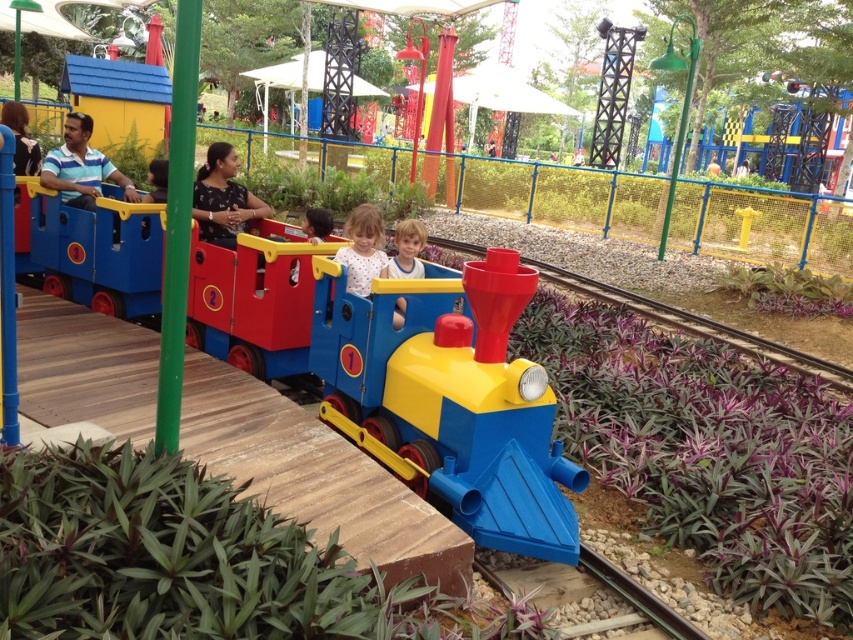
Question: Which point is closer to the camera taking this photo?

Choices:
 (A) (422, 243)
 (B) (352, 275)
 (C) (437, 474)
 (D) (33, 164)

Answer: (C)

Question: In this image, where is matte black shirt at center located relative to polka dot fabric child at center?

Choices:
 (A) below
 (B) above

Answer: (B)

Question: Which object is positioned farthest from the matte black shirt at center?

Choices:
 (A) matte black shirt at upper left
 (B) smooth blue shirt at center
 (C) matte blue shirt at left
 (D) polka dot fabric child at center

Answer: (A)

Question: From the image, what is the correct spatial relationship of polka dot fabric child at center in relation to smooth blue shirt at center?

Choices:
 (A) above
 (B) below

Answer: (B)

Question: Which of the following is the farthest from the observer?

Choices:
 (A) matte blue shirt at left
 (B) polka dot fabric child at center

Answer: (A)

Question: Can you confirm if matte black shirt at center is positioned to the right of polka dot fabric child at center?

Choices:
 (A) yes
 (B) no

Answer: (B)